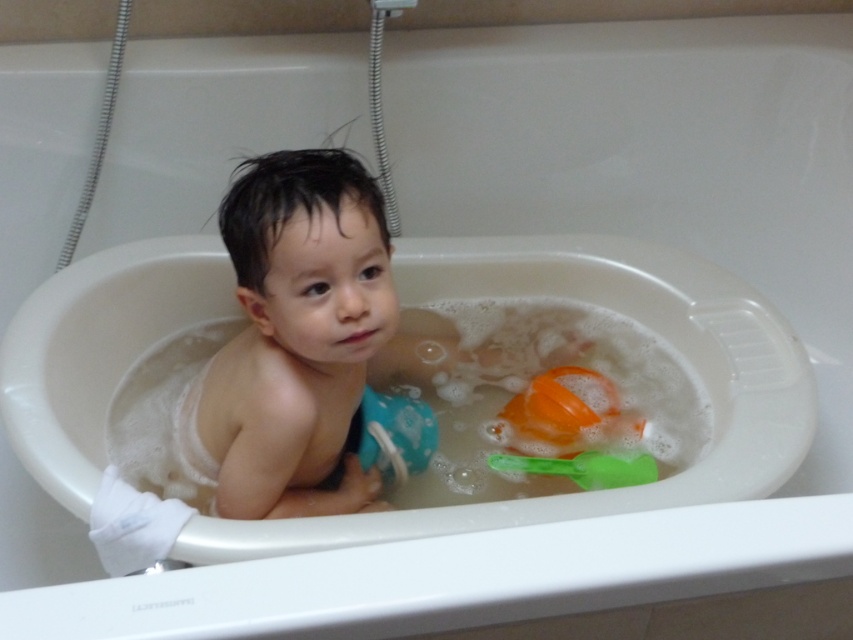
Based on the scene described, can you determine if the smooth skin baby at center could fit through the space between the green plastic spoon at lower right and the edge of the bathtub?

The smooth skin baby at center might be wider than the green plastic spoon at lower right, so it is possible that the baby cannot fit through the space between the spoon and the bathtub edge.

Where is the smooth skin baby at center positioned in the image?

The smooth skin baby at center is positioned at coordinates point (294, 339).